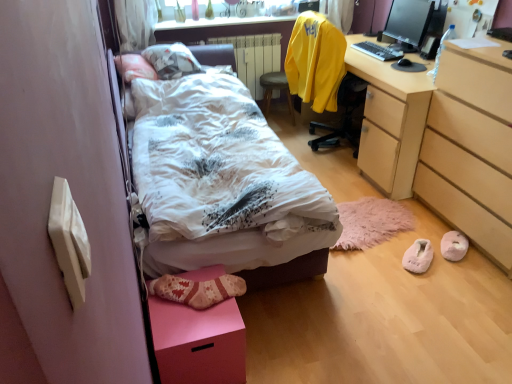
Identify the location of vacant area on top of pink matte shoe box at lower left (from a real-world perspective). This screenshot has width=512, height=384. (195, 302).